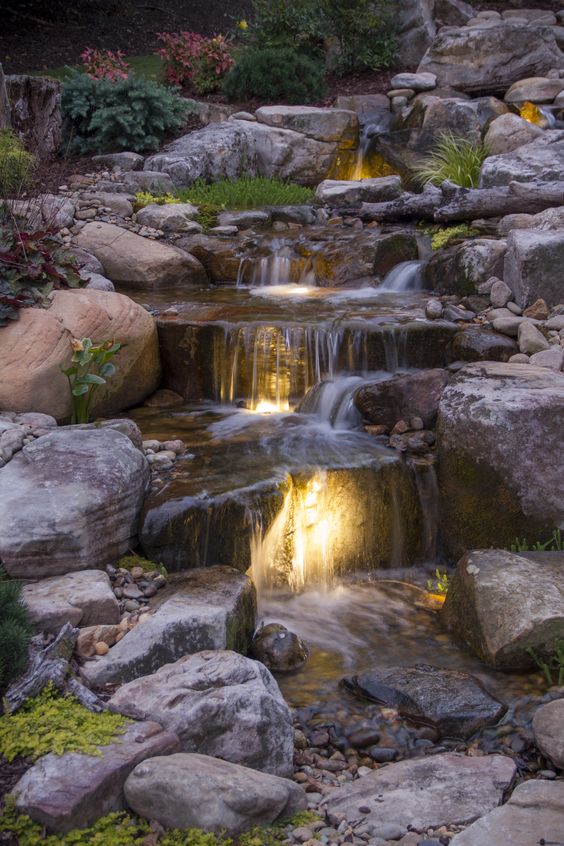
Where is `dark green plants`? Image resolution: width=564 pixels, height=846 pixels. dark green plants is located at coordinates (14, 640).